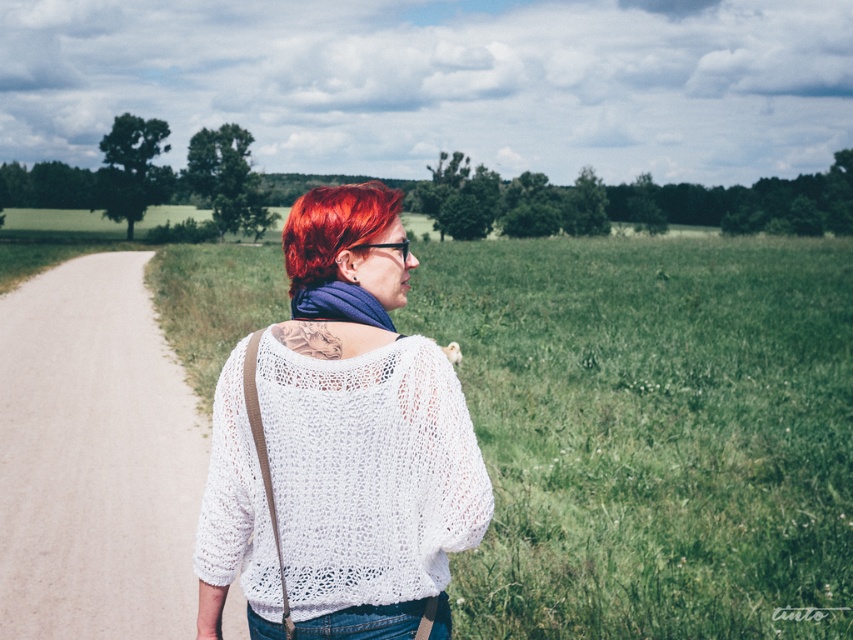
You are a fashion designer observing a person in the scene. The person is wearing a white knitted sweater at center and denim at center. Which clothing item is positioned higher on their body?

The white knitted sweater at center is above denim at center, so the sweater is positioned higher on their body than the denim.

You are a photographer standing behind the person in the image. You want to capture a shot where the green grass at center and denim at center are both visible. Based on their positions, can you see both elements clearly in your frame?

Yes, because the green grass at center is above denim at center, so both elements are visible in the frame.

You are a fashion designer observing the person in the image. You need to determine which item of clothing is wider between the white knitted sweater at center and the denim at center. Which one is wider?

The white knitted sweater at center is wider than the denim at center, as stated in the description that the white knitted sweater at center surpasses denim at center in width.